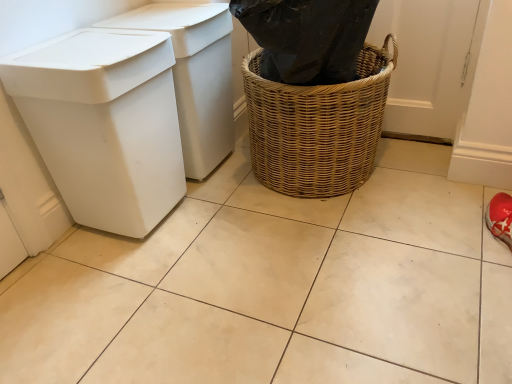
In order to face white plastic bin at left, the first waste container in the back-to-front sequence, should I rotate leftwards or rightwards?

Turn left by 10.124 degrees to look at white plastic bin at left, the first waste container in the back-to-front sequence.

I want to click on white plastic bin at left, acting as the second waste container starting from the front, so click(x=195, y=76).

What do you see at coordinates (104, 124) in the screenshot? I see `white plastic bin at left, which is the 2th waste container in back-to-front order` at bounding box center [104, 124].

I want to click on woven brown basket at center, so click(x=317, y=126).

Is white plastic bin at left, the 1th waste container viewed from the front, positioned with its back to woven brown basket at center?

white plastic bin at left, the 1th waste container viewed from the front, is not turned away from woven brown basket at center.

Is white plastic bin at left, the 1th waste container viewed from the front, to the left or to the right of woven brown basket at center in the image?

Clearly, white plastic bin at left, the 1th waste container viewed from the front, is on the left of woven brown basket at center in the image.

Looking at this image, is white plastic bin at left, the 1th waste container viewed from the front, far from woven brown basket at center?

No, white plastic bin at left, the 1th waste container viewed from the front, is in close proximity to woven brown basket at center.

Considering the positions of objects white plastic bin at left, which is the 2th waste container in back-to-front order, and woven brown basket at center in the image provided, who is in front, white plastic bin at left, which is the 2th waste container in back-to-front order, or woven brown basket at center?

white plastic bin at left, which is the 2th waste container in back-to-front order, is closer to the camera.

From a real-world perspective, is woven brown basket at center positioned above or below white plastic bin at left, the 1th waste container viewed from the front?

woven brown basket at center is situated lower than white plastic bin at left, the 1th waste container viewed from the front, in the real world.

Between woven brown basket at center and white plastic bin at left, the 1th waste container viewed from the front, which one has more height?

With more height is white plastic bin at left, the 1th waste container viewed from the front.

How different are the orientations of white plastic bin at left, the first waste container in the back-to-front sequence, and woven brown basket at center in degrees?

The facing directions of white plastic bin at left, the first waste container in the back-to-front sequence, and woven brown basket at center are 90.9 degrees apart.

Is white plastic bin at left, acting as the second waste container starting from the front, taller than woven brown basket at center?

Yes.

Is the surface of white plastic bin at left, the first waste container in the back-to-front sequence, in direct contact with woven brown basket at center?

There is a gap between white plastic bin at left, the first waste container in the back-to-front sequence, and woven brown basket at center.

Is white plastic bin at left, the first waste container in the back-to-front sequence, facing away from woven brown basket at center?

white plastic bin at left, the first waste container in the back-to-front sequence, does not have its back to woven brown basket at center.

Is the surface of woven brown basket at center in direct contact with white plastic bin at left, the first waste container in the back-to-front sequence?

woven brown basket at center and white plastic bin at left, the first waste container in the back-to-front sequence, are not in contact.

From a real-world perspective, between woven brown basket at center and white plastic bin at left, acting as the second waste container starting from the front, who is vertically lower?

woven brown basket at center.

Which object is positioned more to the right, woven brown basket at center or white plastic bin at left, the first waste container in the back-to-front sequence?

woven brown basket at center is more to the right.

Does woven brown basket at center lie in front of white plastic bin at left, acting as the second waste container starting from the front?

Yes, woven brown basket at center is in front of white plastic bin at left, acting as the second waste container starting from the front.

Considering the sizes of objects white plastic bin at left, acting as the second waste container starting from the front, and white plastic bin at left, which is the 2th waste container in back-to-front order, in the image provided, who is taller, white plastic bin at left, acting as the second waste container starting from the front, or white plastic bin at left, which is the 2th waste container in back-to-front order,?

white plastic bin at left, which is the 2th waste container in back-to-front order, is taller.

In the scene shown: From a real-world perspective, which object rests below the other?

From a 3D spatial view, white plastic bin at left, acting as the second waste container starting from the front, is below.

Is white plastic bin at left, acting as the second waste container starting from the front, positioned with its back to white plastic bin at left, the 1th waste container viewed from the front?

No, white plastic bin at left, the 1th waste container viewed from the front, is not at the back of white plastic bin at left, acting as the second waste container starting from the front.

Between white plastic bin at left, the first waste container in the back-to-front sequence, and white plastic bin at left, the 1th waste container viewed from the front, which one is positioned in front?

Positioned in front is white plastic bin at left, the 1th waste container viewed from the front.

Does point (74, 189) come closer to viewer compared to point (165, 31)?

Yes, it is.

Does white plastic bin at left, the 1th waste container viewed from the front, have a greater height compared to white plastic bin at left, the first waste container in the back-to-front sequence?

Indeed, white plastic bin at left, the 1th waste container viewed from the front, has a greater height compared to white plastic bin at left, the first waste container in the back-to-front sequence.

From the picture: Is white plastic bin at left, which is the 2th waste container in back-to-front order, inside the boundaries of white plastic bin at left, acting as the second waste container starting from the front, or outside?

white plastic bin at left, which is the 2th waste container in back-to-front order, cannot be found inside white plastic bin at left, acting as the second waste container starting from the front.

The image size is (512, 384). I want to click on waste container lying above the white plastic bin at left, which is the 2th waste container in back-to-front order (from the image's perspective), so click(x=195, y=76).

At what (x,y) coordinates should I click in order to perform the action: click on basket container lying on the right of white plastic bin at left, the 1th waste container viewed from the front. Please return your answer as a coordinate pair (x, y). Image resolution: width=512 pixels, height=384 pixels. Looking at the image, I should click on (317, 126).

Where is `the 2nd waste container counting from the left of the woven brown basket at center`? the 2nd waste container counting from the left of the woven brown basket at center is located at coordinates (104, 124).

When comparing their distances from white plastic bin at left, the first waste container in the back-to-front sequence, does woven brown basket at center or white plastic bin at left, the 1th waste container viewed from the front, seem further?

woven brown basket at center lies further to white plastic bin at left, the first waste container in the back-to-front sequence, than the other object.

Which object lies further to the anchor point white plastic bin at left, the 1th waste container viewed from the front, woven brown basket at center or white plastic bin at left, acting as the second waste container starting from the front?

Based on the image, woven brown basket at center appears to be further to white plastic bin at left, the 1th waste container viewed from the front.

Considering their positions, is white plastic bin at left, acting as the second waste container starting from the front, positioned further to white plastic bin at left, which is the 2th waste container in back-to-front order, than woven brown basket at center?

woven brown basket at center.

Based on their spatial positions, is white plastic bin at left, the 1th waste container viewed from the front, or white plastic bin at left, acting as the second waste container starting from the front, further from woven brown basket at center?

white plastic bin at left, the 1th waste container viewed from the front, is further to woven brown basket at center.

Which object lies nearer to the anchor point woven brown basket at center, white plastic bin at left, the first waste container in the back-to-front sequence, or white plastic bin at left, the 1th waste container viewed from the front?

white plastic bin at left, the first waste container in the back-to-front sequence, is positioned closer to the anchor woven brown basket at center.

From the image, which object appears to be nearer to white plastic bin at left, the first waste container in the back-to-front sequence, white plastic bin at left, the 1th waste container viewed from the front, or woven brown basket at center?

Based on the image, white plastic bin at left, the 1th waste container viewed from the front, appears to be nearer to white plastic bin at left, the first waste container in the back-to-front sequence.

Locate an element on the screen. Image resolution: width=512 pixels, height=384 pixels. waste container between white plastic bin at left, which is the 2th waste container in back-to-front order, and woven brown basket at center is located at coordinates (195, 76).